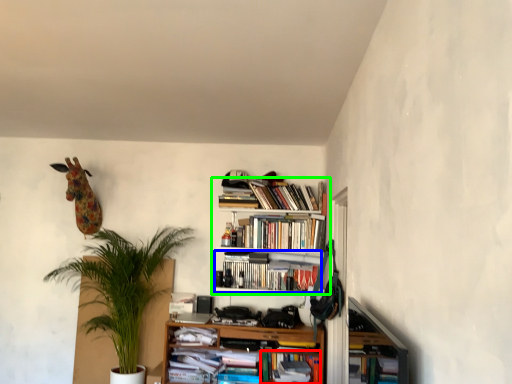
Question: Which is nearer to the book (highlighted by a red box)? book (highlighted by a blue box) or bookcase (highlighted by a green box).

Choices:
 (A) book
 (B) bookcase

Answer: (A)